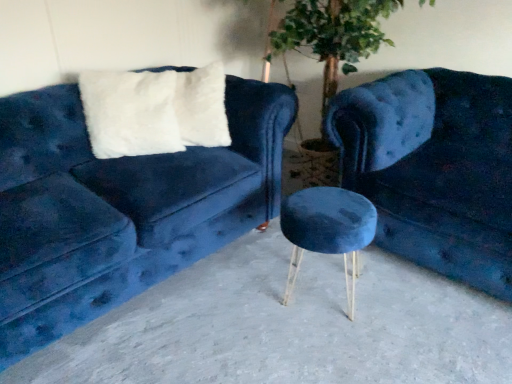
Identify the location of vacant space to the right of velvet blue stool at center. (406, 293).